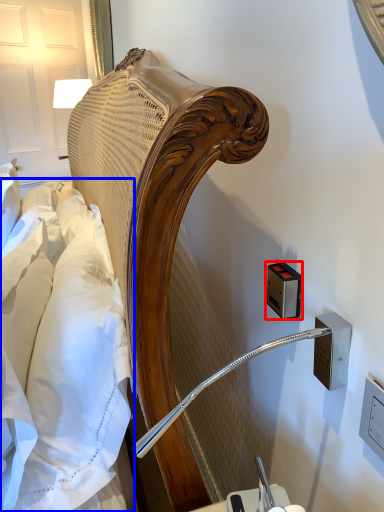
Question: Which object is closer to the camera taking this photo, electric outlet (highlighted by a red box) or sheet (highlighted by a blue box)?

Choices:
 (A) electric outlet
 (B) sheet

Answer: (B)